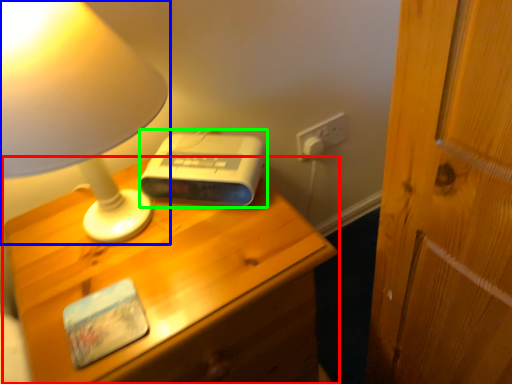
Question: Estimate the real-world distances between objects in this image. Which object is closer to nightstand (highlighted by a red box), lamp (highlighted by a blue box) or gadget (highlighted by a green box)?

Choices:
 (A) lamp
 (B) gadget

Answer: (B)